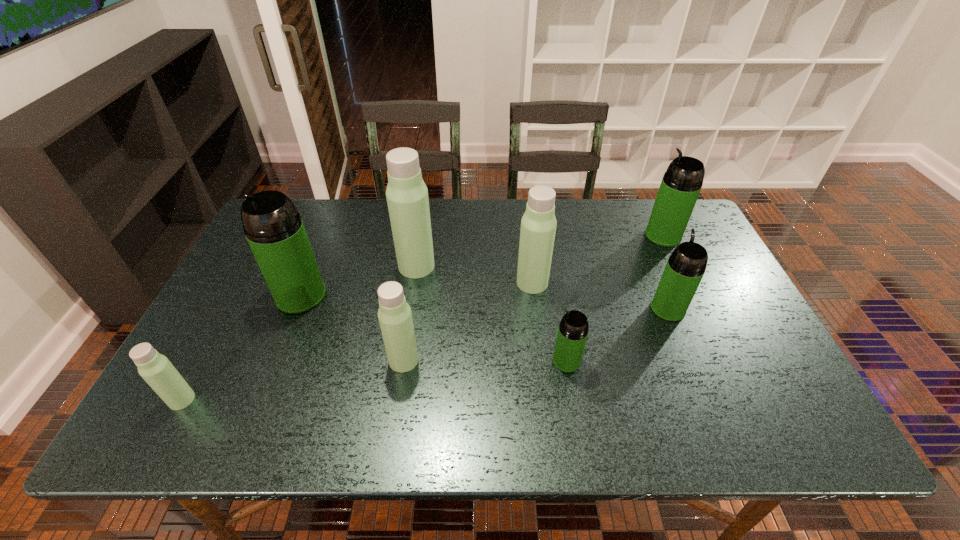
Identify which light thermos bottle is the closest to the second biggest green thermos bottle. Please provide its 2D coordinates. Your answer should be formatted as a tuple, i.e. [(x, y)], where the tuple contains the x and y coordinates of a point satisfying the conditions above.

[(538, 225)]

Point out which light thermos bottle is positioned as the third nearest to the leftmost light thermos bottle. Please provide its 2D coordinates. Your answer should be formatted as a tuple, i.e. [(x, y)], where the tuple contains the x and y coordinates of a point satisfying the conditions above.

[(538, 225)]

Image resolution: width=960 pixels, height=540 pixels. I want to click on free spot that satisfies the following two spatial constraints: 1. on the front side of the biggest light thermos bottle; 2. on the left side of the second smallest light thermos bottle, so click(x=402, y=360).

Locate an element on the screen. This screenshot has width=960, height=540. free location that satisfies the following two spatial constraints: 1. on the back side of the third biggest light thermos bottle; 2. on the right side of the leftmost light thermos bottle is located at coordinates (204, 360).

You are a GUI agent. You are given a task and a screenshot of the screen. Output one action in this format:
    pyautogui.click(x=<x>, y=<y>)
    Task: Click on the free space that satisfies the following two spatial constraints: 1. from the spout of the farthest green thermos bottle; 2. from the spout of the seventh object from right to left
    The width and height of the screenshot is (960, 540).
    Given the screenshot: What is the action you would take?
    pyautogui.click(x=691, y=295)